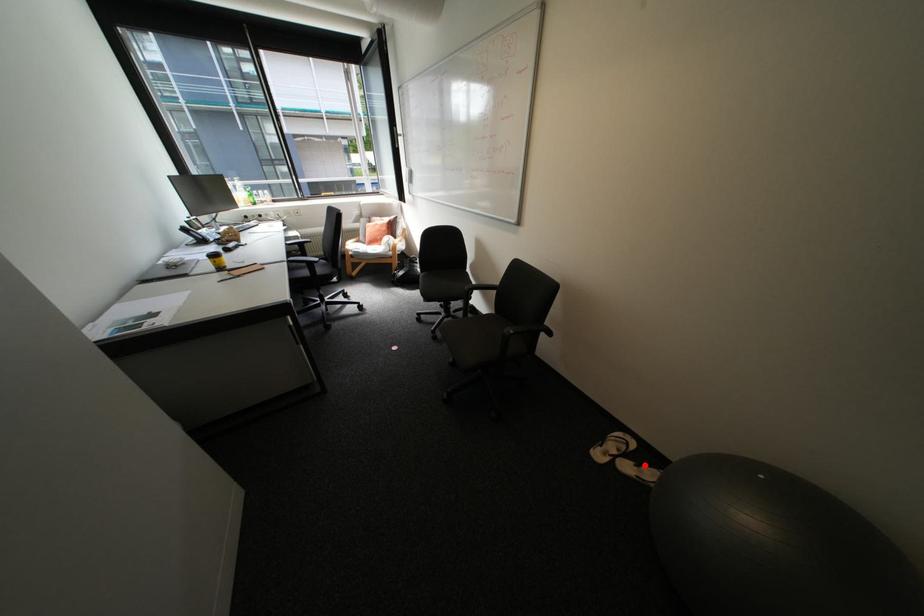
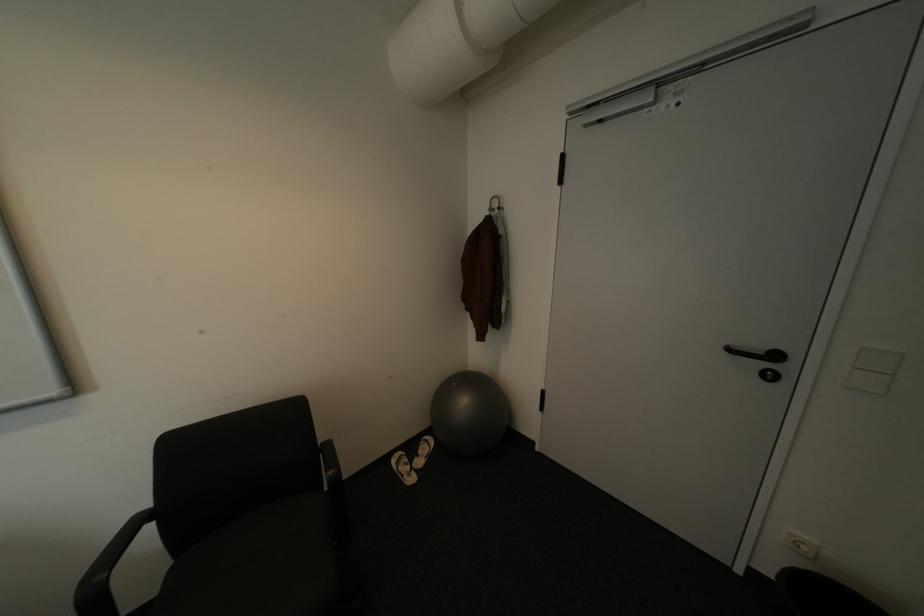
Find the pixel in the second image that matches the highlighted location in the first image.

(428, 456)